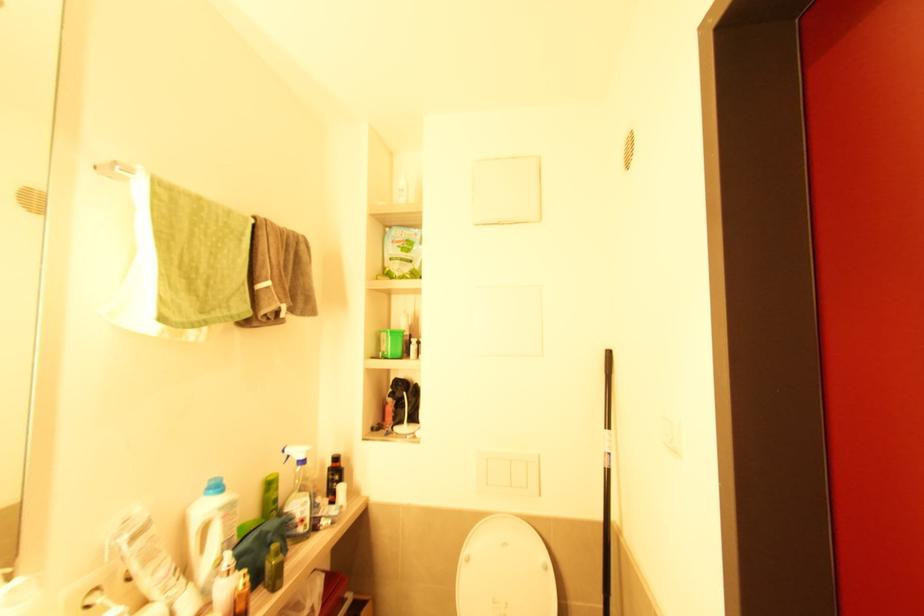
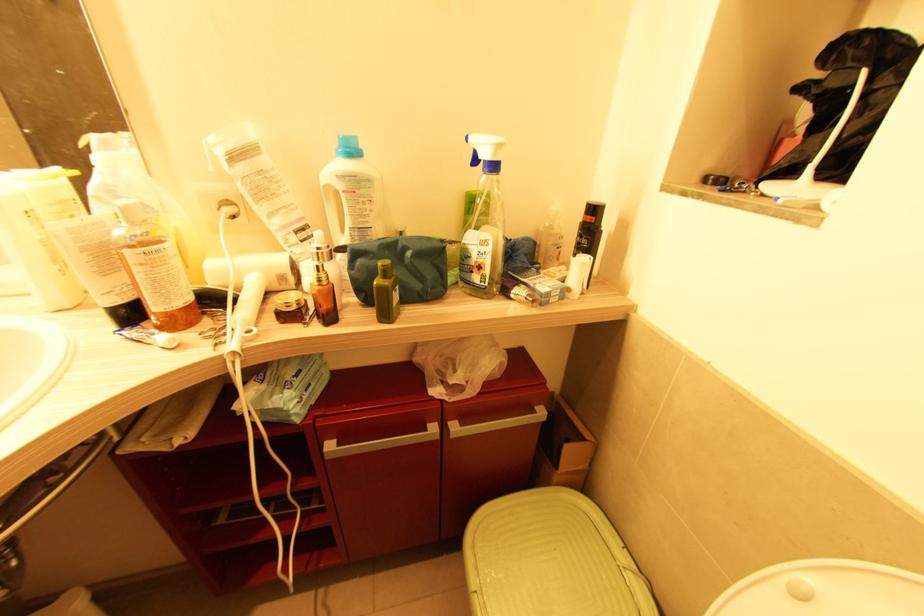
Find the pixel in the second image that matches (407,394) in the first image.

(867, 73)